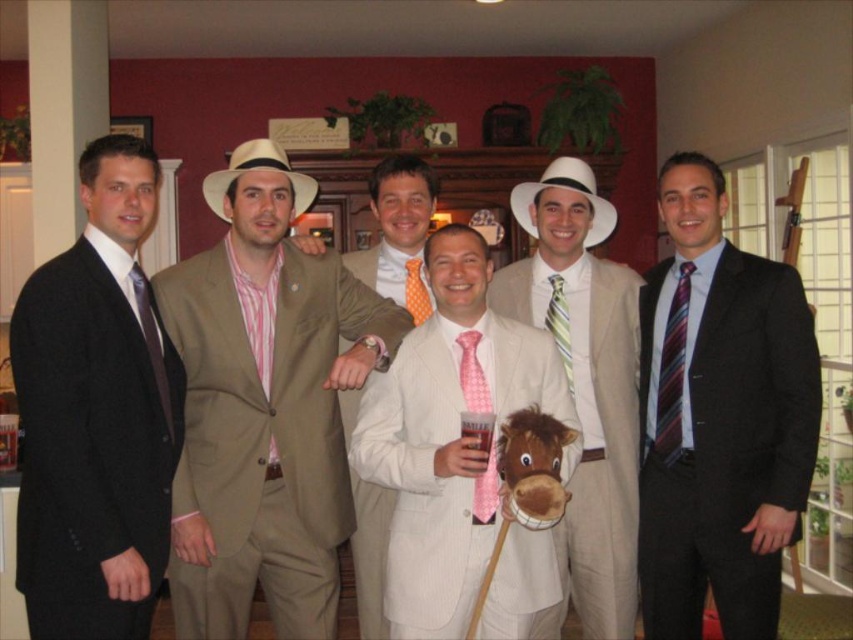
You are a photographer trying to arrange the men in the living room so that the pinstripe suit at center and the orange polka dot tie at center are visible. Based on their positions, which object is lower in the image?

The pinstripe suit at center is positioned under the orange polka dot tie at center, so the pinstripe suit at center is lower in the image.

You are a photographer arranging a group photo. You need to ensure that the striped tie at right and the orange polka dot tie at center are visible in the final shot. Given their sizes, which tie might require more space in the frame to be fully visible?

The striped tie at right requires more space in the frame because its width is larger than the orange polka dot tie at center.